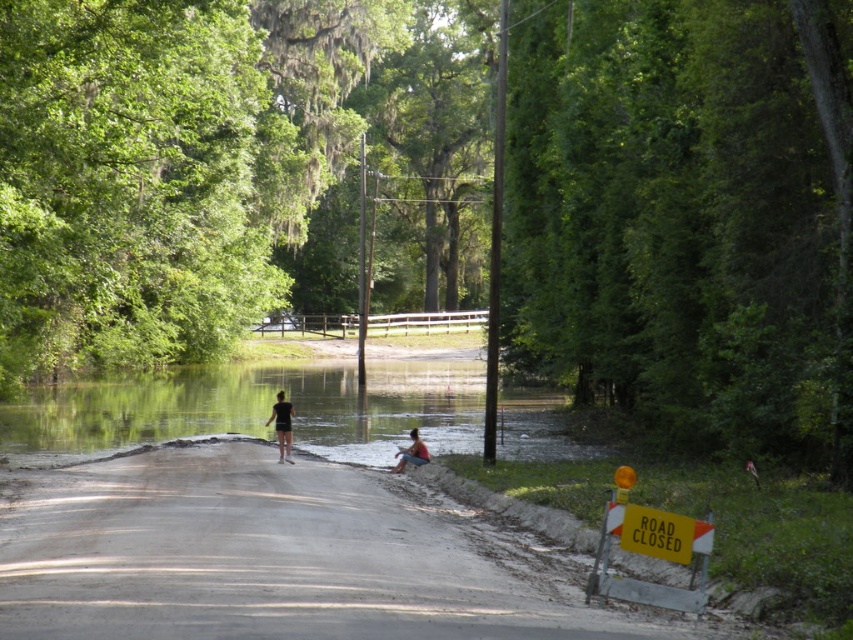
Question: Which of the following is the closest to the observer?

Choices:
 (A) (312, 371)
 (B) (280, 388)

Answer: (B)

Question: Is black matte shorts at center above blue denim shorts at center?

Choices:
 (A) yes
 (B) no

Answer: (A)

Question: Is clear water at center positioned before blue denim shorts at center?

Choices:
 (A) no
 (B) yes

Answer: (A)

Question: Which object appears closest to the camera in this image?

Choices:
 (A) black matte shorts at center
 (B) clear water at center

Answer: (A)

Question: Which point is farther from the camera taking this photo?

Choices:
 (A) (283, 397)
 (B) (410, 454)

Answer: (A)

Question: Does black matte shorts at center appear under blue denim shorts at center?

Choices:
 (A) yes
 (B) no

Answer: (B)